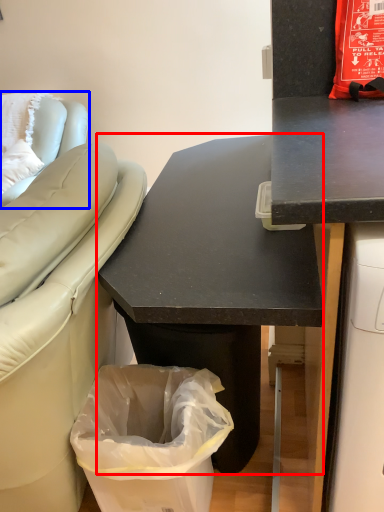
Question: Which point is closer to the camera, desk (highlighted by a red box) or furniture (highlighted by a blue box)?

Choices:
 (A) desk
 (B) furniture

Answer: (A)